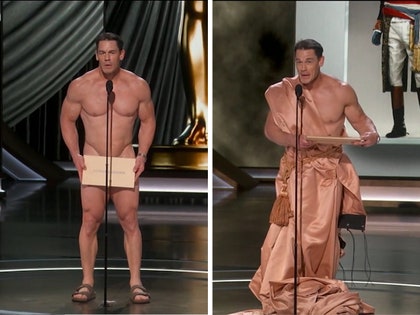
This screenshot has width=420, height=315. Identify the location of stage curtains. (58, 49), (134, 39).